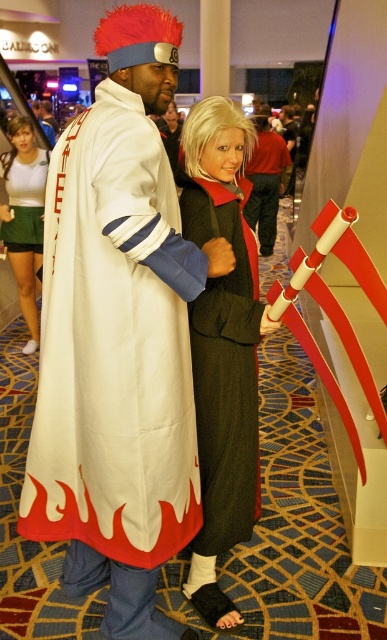
Question: Which object appears closest to the camera in this image?

Choices:
 (A) matte black jacket at center
 (B) white matte cape at center

Answer: (B)

Question: Does matte green skirt at lower left appear over matte black jacket at center?

Choices:
 (A) yes
 (B) no

Answer: (B)

Question: Which is farther from the matte green skirt at lower left?

Choices:
 (A) green wool coat at center
 (B) white matte cape at center

Answer: (B)

Question: From the image, what is the correct spatial relationship of white matte cape at center in relation to matte black jacket at center?

Choices:
 (A) right
 (B) left

Answer: (B)

Question: Is white matte cape at center to the left of matte green skirt at lower left from the viewer's perspective?

Choices:
 (A) yes
 (B) no

Answer: (B)

Question: Which point is closer to the camera?

Choices:
 (A) (234, 317)
 (B) (126, 68)

Answer: (B)